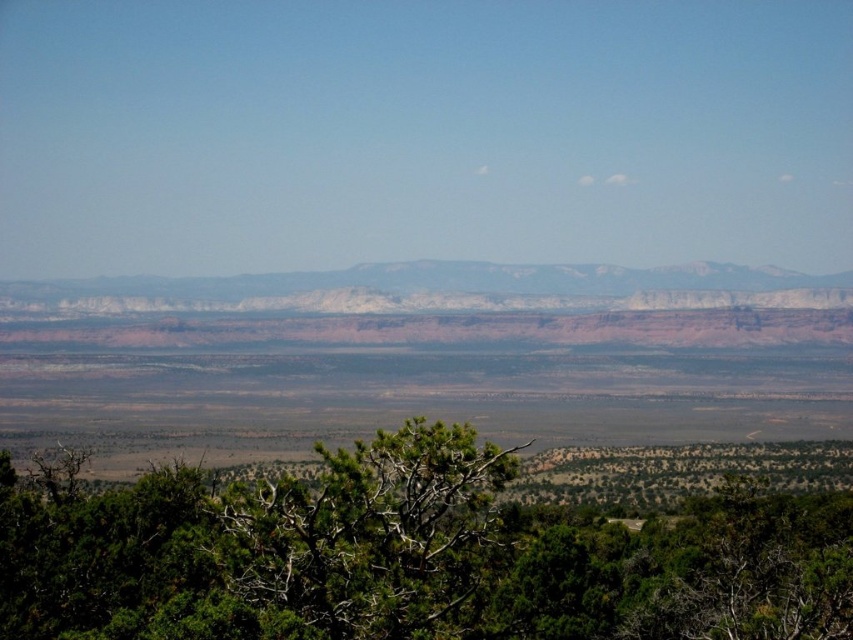
Question: Does green leafy tree at center appear on the left side of white sandstone mountains at center?

Choices:
 (A) no
 (B) yes

Answer: (A)

Question: Among these points, which one is farthest from the camera?

Choices:
 (A) (650, 576)
 (B) (351, 275)

Answer: (B)

Question: Does green leafy tree at center appear on the left side of white sandstone mountains at center?

Choices:
 (A) yes
 (B) no

Answer: (B)

Question: Does green leafy tree at center appear on the left side of white sandstone mountains at center?

Choices:
 (A) yes
 (B) no

Answer: (B)

Question: Which point appears farthest from the camera in this image?

Choices:
 (A) (456, 484)
 (B) (490, 288)

Answer: (B)